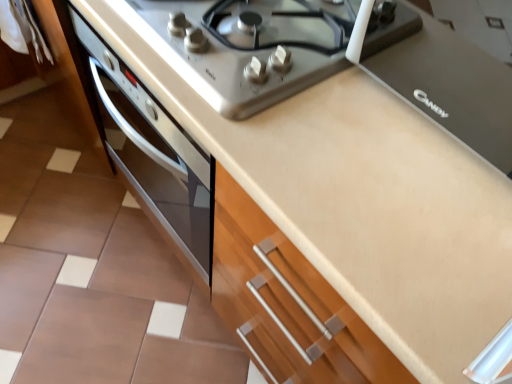
This screenshot has height=384, width=512. Find the location of `vacant space underneath black matte stove top at upper center (from a real-world perspective)`. vacant space underneath black matte stove top at upper center (from a real-world perspective) is located at coordinates (447, 87).